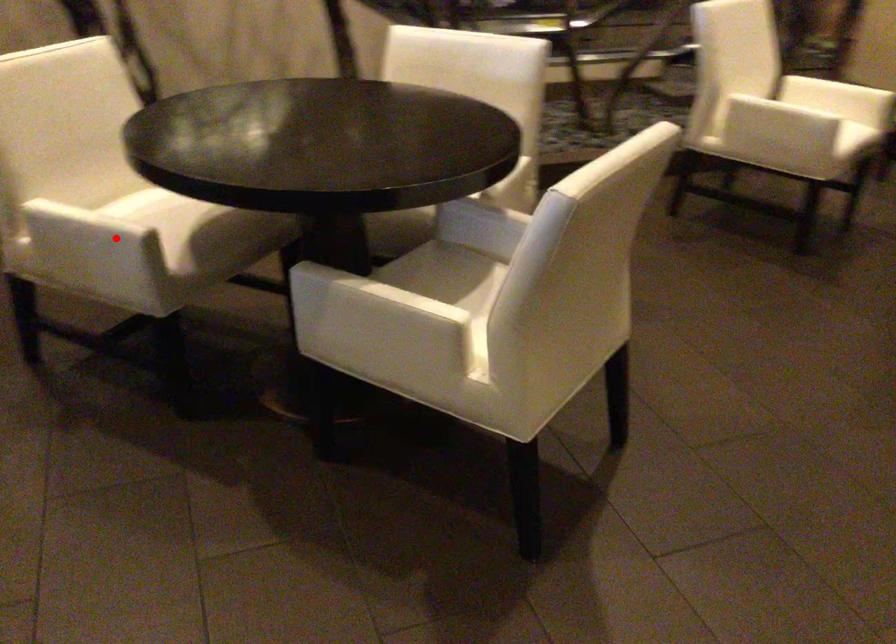
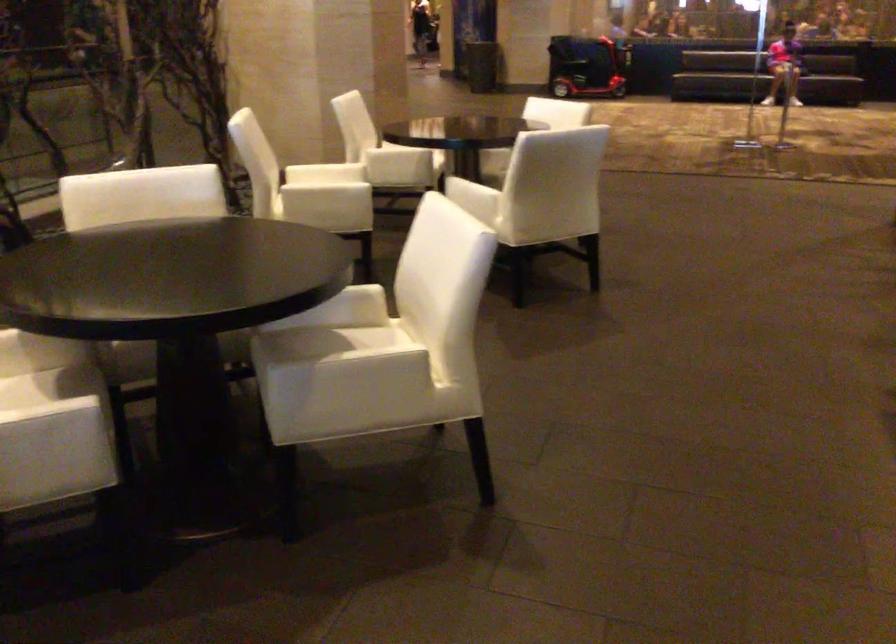
Question: I am providing you with two images of the same scene from different viewpoints. A red point is marked on the first image. Is the red point's position out of view in image 2?

Choices:
 (A) Yes
 (B) No

Answer: (B)